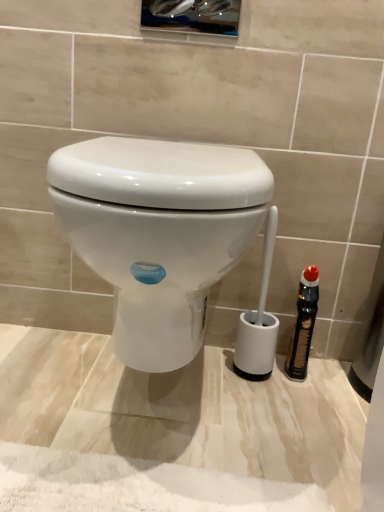
Question: Does black plastic bottle at right have a larger size compared to white glossy toilet at center?

Choices:
 (A) no
 (B) yes

Answer: (A)

Question: Can you see black plastic bottle at right touching white glossy toilet at center?

Choices:
 (A) yes
 (B) no

Answer: (B)

Question: Is black plastic bottle at right shorter than white glossy toilet at center?

Choices:
 (A) yes
 (B) no

Answer: (A)

Question: Does black plastic bottle at right have a smaller size compared to white glossy toilet at center?

Choices:
 (A) no
 (B) yes

Answer: (B)

Question: Would you say white glossy toilet at center is part of black plastic bottle at right's contents?

Choices:
 (A) yes
 (B) no

Answer: (B)

Question: From the image's perspective, is black plastic bottle at right below white glossy toilet at center?

Choices:
 (A) yes
 (B) no

Answer: (A)

Question: Is the surface of white glossy toilet at center in direct contact with black plastic bottle at right?

Choices:
 (A) no
 (B) yes

Answer: (A)

Question: Considering the relative sizes of white glossy toilet at center and black plastic bottle at right in the image provided, is white glossy toilet at center bigger than black plastic bottle at right?

Choices:
 (A) no
 (B) yes

Answer: (B)

Question: From a real-world perspective, is white glossy toilet at center positioned over black plastic bottle at right based on gravity?

Choices:
 (A) yes
 (B) no

Answer: (A)

Question: Would you say white glossy toilet at center is a long distance from black plastic bottle at right?

Choices:
 (A) yes
 (B) no

Answer: (B)

Question: Could you tell me if white glossy toilet at center is facing black plastic bottle at right?

Choices:
 (A) yes
 (B) no

Answer: (B)

Question: Would you say white glossy toilet at center contains black plastic bottle at right?

Choices:
 (A) yes
 (B) no

Answer: (B)

Question: Is black plastic bottle at right situated inside white glossy toilet at center or outside?

Choices:
 (A) outside
 (B) inside

Answer: (A)